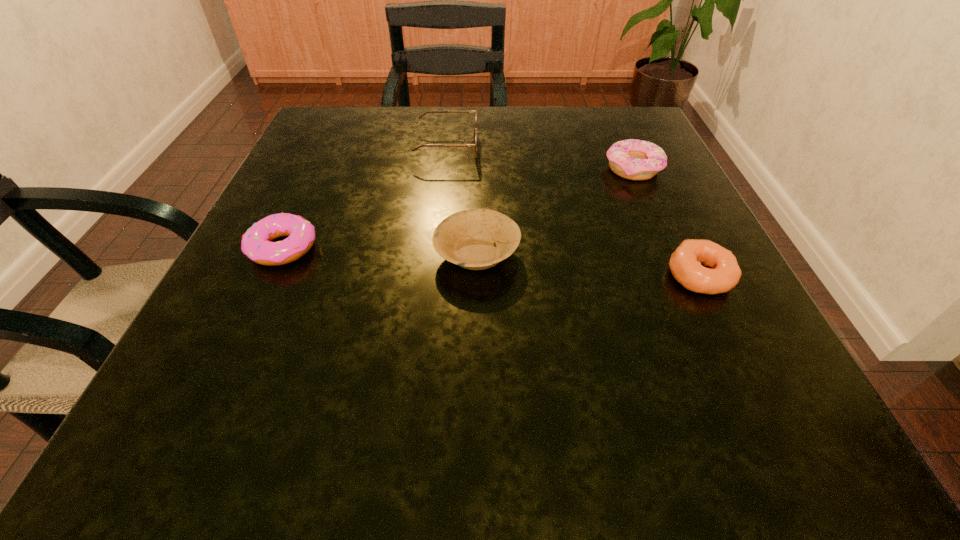
Locate an element on the screen. The height and width of the screenshot is (540, 960). object positioned at the left edge is located at coordinates (256, 244).

At what (x,y) coordinates should I click in order to perform the action: click on object located at the far right corner. Please return your answer as a coordinate pair (x, y). The width and height of the screenshot is (960, 540). Looking at the image, I should click on (632, 159).

This screenshot has width=960, height=540. Find the location of `vacant region at the far edge`. vacant region at the far edge is located at coordinates (544, 156).

Image resolution: width=960 pixels, height=540 pixels. Find the location of `vacant space at the near edge`. vacant space at the near edge is located at coordinates (388, 431).

You are a GUI agent. You are given a task and a screenshot of the screen. Output one action in this format:
    pyautogui.click(x=<x>, y=<y>)
    Task: Click on the blank area at the left edge
    The height and width of the screenshot is (540, 960).
    Given the screenshot: What is the action you would take?
    pyautogui.click(x=173, y=375)

Find the location of a particular element. This screenshot has width=960, height=540. vacant space at the right edge of the desktop is located at coordinates (651, 221).

The width and height of the screenshot is (960, 540). I want to click on vacant space at the near right corner, so (x=750, y=472).

Find the location of a particular element. Image resolution: width=960 pixels, height=540 pixels. empty space between the farthest doughnut and the bowl is located at coordinates (555, 212).

The height and width of the screenshot is (540, 960). Identify the location of free space that is in between the leftmost doughnut and the farthest doughnut. (458, 208).

This screenshot has width=960, height=540. Identify the location of empty space between the spectacles and the leftmost doughnut. (365, 198).